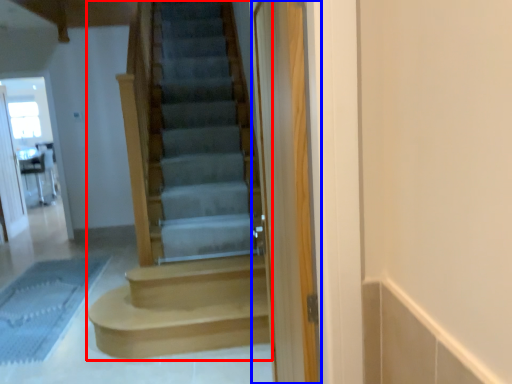
Question: Which point is closer to the camera, stairs (highlighted by a red box) or screen door (highlighted by a blue box)?

Choices:
 (A) stairs
 (B) screen door

Answer: (A)